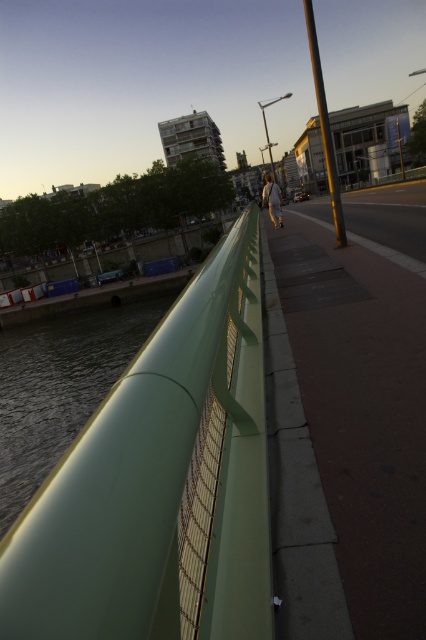
How far apart are green matte railing at lower left and white fabric at center?

16.35 meters

Who is lower down, green matte railing at lower left or white fabric at center?

green matte railing at lower left is below.

The width and height of the screenshot is (426, 640). What do you see at coordinates (60, 387) in the screenshot?
I see `green matte railing at lower left` at bounding box center [60, 387].

The height and width of the screenshot is (640, 426). Find the location of `green matte railing at lower left`. green matte railing at lower left is located at coordinates (60, 387).

Can you confirm if dark gray concrete pavement at center is thinner than white fabric at center?

In fact, dark gray concrete pavement at center might be wider than white fabric at center.

The height and width of the screenshot is (640, 426). In order to click on dark gray concrete pavement at center in this screenshot , I will do [x=345, y=433].

Who is more distant from viewer, (298, 285) or (267, 180)?

The point (267, 180) is behind.

Where is `dark gray concrete pavement at center`? This screenshot has height=640, width=426. dark gray concrete pavement at center is located at coordinates (345, 433).

Locate an element on the screen. dark gray concrete pavement at center is located at coordinates (345, 433).

Can you confirm if dark gray concrete pavement at center is wider than green matte railing at lower left?

In fact, dark gray concrete pavement at center might be narrower than green matte railing at lower left.

Image resolution: width=426 pixels, height=640 pixels. In order to click on dark gray concrete pavement at center in this screenshot , I will do `click(345, 433)`.

Image resolution: width=426 pixels, height=640 pixels. I want to click on dark gray concrete pavement at center, so click(345, 433).